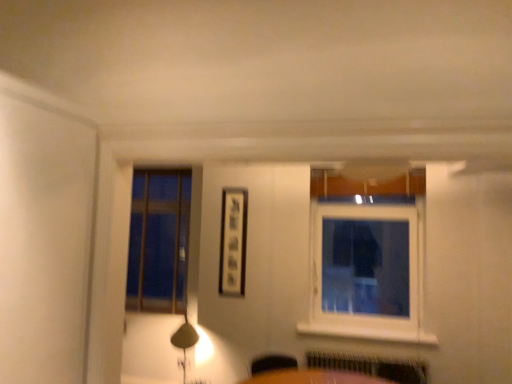
Question: Is matte black picture frame at center at the back of white plastic window at upper right?

Choices:
 (A) no
 (B) yes

Answer: (A)

Question: Is white plastic window at upper right not near matte black picture frame at center?

Choices:
 (A) yes
 (B) no

Answer: (A)

Question: From the image's perspective, does white plastic window at upper right appear higher than matte black picture frame at center?

Choices:
 (A) yes
 (B) no

Answer: (B)

Question: Is white plastic window at upper right facing towards matte black picture frame at center?

Choices:
 (A) no
 (B) yes

Answer: (A)

Question: Is white plastic window at upper right to the left of matte black picture frame at center from the viewer's perspective?

Choices:
 (A) no
 (B) yes

Answer: (A)

Question: Is white plastic window at upper right taller than matte black picture frame at center?

Choices:
 (A) yes
 (B) no

Answer: (A)

Question: Considering the relative sizes of matte black picture frame at center and white plastic window at upper right in the image provided, is matte black picture frame at center wider than white plastic window at upper right?

Choices:
 (A) yes
 (B) no

Answer: (B)

Question: Is white plastic window at upper right at the back of matte black picture frame at center?

Choices:
 (A) yes
 (B) no

Answer: (B)

Question: Is matte black picture frame at center next to white plastic window at upper right and touching it?

Choices:
 (A) yes
 (B) no

Answer: (B)

Question: Is matte black picture frame at center surrounding white plastic window at upper right?

Choices:
 (A) no
 (B) yes

Answer: (A)

Question: Is matte black picture frame at center bigger than white plastic window at upper right?

Choices:
 (A) no
 (B) yes

Answer: (A)

Question: Is matte black picture frame at center completely or partially outside of white plastic window at upper right?

Choices:
 (A) yes
 (B) no

Answer: (A)

Question: Is white painted wood at lower center looking in the opposite direction of white plastic window at upper right?

Choices:
 (A) yes
 (B) no

Answer: (B)